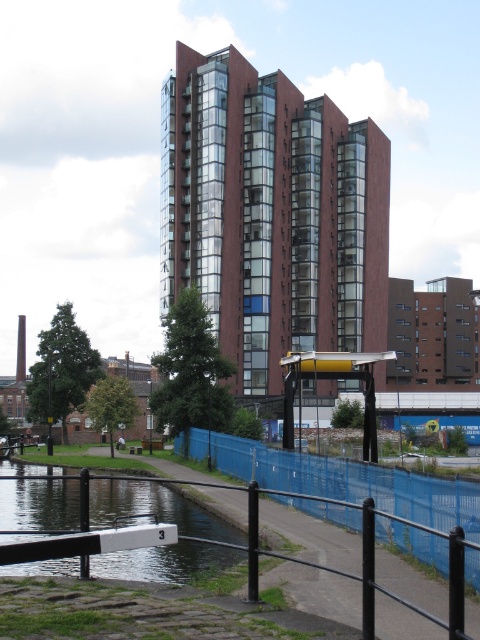
Question: Does red brick building at center lie in front of smooth concrete river at lower left?

Choices:
 (A) no
 (B) yes

Answer: (A)

Question: Considering the real-world distances, which object is closest to the red brick building at center?

Choices:
 (A) wooden park bench at center
 (B) blue plastic fence at lower center
 (C) smooth concrete river at lower left

Answer: (A)

Question: Is the position of red brick building at center more distant than that of smooth concrete river at lower left?

Choices:
 (A) no
 (B) yes

Answer: (B)

Question: Which object is farther from the camera taking this photo?

Choices:
 (A) blue plastic fence at lower center
 (B) wooden park bench at center
 (C) smooth concrete river at lower left
 (D) red brick building at center

Answer: (D)

Question: Is red brick building at center thinner than blue plastic fence at lower center?

Choices:
 (A) no
 (B) yes

Answer: (A)

Question: Which point is farther from the camera taking this photo?

Choices:
 (A) (228, 88)
 (B) (134, 449)
 (C) (50, 568)

Answer: (A)